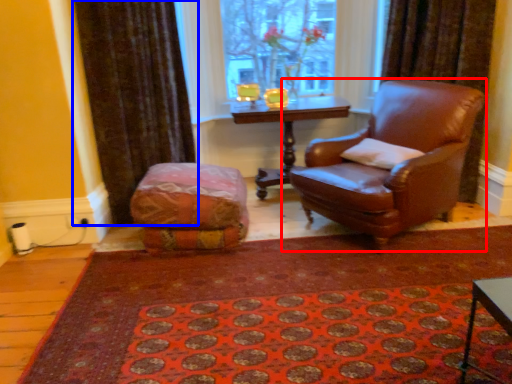
Question: Which of the following is the farthest to the observer, chair (highlighted by a red box) or curtain (highlighted by a blue box)?

Choices:
 (A) chair
 (B) curtain

Answer: (B)